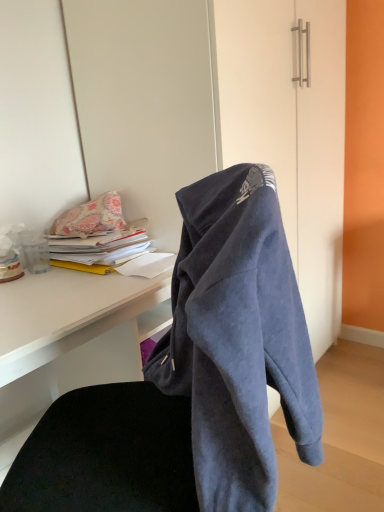
What do you see at coordinates (90, 218) in the screenshot? I see `floral fabric pillow at upper left` at bounding box center [90, 218].

What is the approximate height of matte white desk at center?

29.46 inches.

The width and height of the screenshot is (384, 512). What do you see at coordinates (103, 250) in the screenshot? I see `yellow paper at left` at bounding box center [103, 250].

Measure the distance between dark blue fleece hoodie at center and camera.

A distance of 20.55 inches exists between dark blue fleece hoodie at center and camera.

Locate an element on the screen. The width and height of the screenshot is (384, 512). floral fabric pillow at upper left is located at coordinates (90, 218).

Looking at this image, from a real-world perspective, between yellow paper at left and matte white desk at center, who is vertically lower?

In real-world perspective, matte white desk at center is lower.

Between point (116, 245) and point (35, 319), which one is positioned behind?

The point (116, 245) is behind.

Can you confirm if yellow paper at left is shorter than matte white desk at center?

Correct, yellow paper at left is not as tall as matte white desk at center.

Which object is closer to the camera taking this photo, dark blue fleece hoodie at center or yellow paper at left?

dark blue fleece hoodie at center is closer to the camera.

Between dark blue fleece hoodie at center and yellow paper at left, which one has larger width?

yellow paper at left is wider.

Is dark blue fleece hoodie at center touching yellow paper at left?

There is a gap between dark blue fleece hoodie at center and yellow paper at left.

Which is more to the left, dark blue fleece hoodie at center or yellow paper at left?

yellow paper at left.

Considering the positions of objects dark blue fleece hoodie at center and floral fabric pillow at upper left in the image provided, who is behind, dark blue fleece hoodie at center or floral fabric pillow at upper left?

floral fabric pillow at upper left is further from the camera.

Is floral fabric pillow at upper left located within dark blue fleece hoodie at center?

No.

Does dark blue fleece hoodie at center have a larger size compared to floral fabric pillow at upper left?

Yes.

Is dark blue fleece hoodie at center wider than floral fabric pillow at upper left?

Correct, the width of dark blue fleece hoodie at center exceeds that of floral fabric pillow at upper left.

Locate an element on the screen. The height and width of the screenshot is (512, 384). pillow above the yellow paper at left (from a real-world perspective) is located at coordinates (90, 218).

Is floral fabric pillow at upper left inside yellow paper at left?

No, yellow paper at left does not contain floral fabric pillow at upper left.

Is yellow paper at left looking in the opposite direction of floral fabric pillow at upper left?

yellow paper at left is not turned away from floral fabric pillow at upper left.

Considering the sizes of yellow paper at left and floral fabric pillow at upper left in the image, is yellow paper at left bigger or smaller than floral fabric pillow at upper left?

Clearly, yellow paper at left is larger in size than floral fabric pillow at upper left.

Is dark blue fleece hoodie at center inside yellow paper at left?

That's incorrect, dark blue fleece hoodie at center is not inside yellow paper at left.

From the picture: Is yellow paper at left in front of dark blue fleece hoodie at center?

No, yellow paper at left is further to the viewer.

From the image's perspective, is yellow paper at left located above or below dark blue fleece hoodie at center?

yellow paper at left is above dark blue fleece hoodie at center.

Between yellow paper at left and dark blue fleece hoodie at center, which one has smaller size?

yellow paper at left is smaller.

From the image's perspective, does dark blue fleece hoodie at center appear lower than matte white desk at center?

No, from the image's perspective, dark blue fleece hoodie at center is not below matte white desk at center.

Does dark blue fleece hoodie at center have a smaller size compared to matte white desk at center?

Indeed, dark blue fleece hoodie at center has a smaller size compared to matte white desk at center.

Is dark blue fleece hoodie at center positioned behind matte white desk at center?

No, dark blue fleece hoodie at center is in front of matte white desk at center.

How different are the orientations of dark blue fleece hoodie at center and matte white desk at center in degrees?

dark blue fleece hoodie at center and matte white desk at center are facing 136 degrees away from each other.

Which is nearer, (x=111, y=204) or (x=65, y=309)?

The point (x=65, y=309) is more forward.

The width and height of the screenshot is (384, 512). What are the coordinates of `desk to the right of floral fabric pillow at upper left` in the screenshot? It's located at (73, 341).

Based on the photo, does floral fabric pillow at upper left appear on the left side of matte white desk at center?

Yes.

From a real-world perspective, who is located higher, floral fabric pillow at upper left or matte white desk at center?

In real-world perspective, floral fabric pillow at upper left is above.

Locate an element on the screen. The height and width of the screenshot is (512, 384). book above the matte white desk at center (from the image's perspective) is located at coordinates (103, 250).

You are a GUI agent. You are given a task and a screenshot of the screen. Output one action in this format:
    pyautogui.click(x=<x>, y=<y>)
    Task: Click on the book behind the dark blue fleece hoodie at center
    The width and height of the screenshot is (384, 512).
    Given the screenshot: What is the action you would take?
    pyautogui.click(x=103, y=250)

Considering their positions, is dark blue fleece hoodie at center positioned closer to yellow paper at left than matte white desk at center?

The object closer to yellow paper at left is matte white desk at center.

Which object lies further to the anchor point floral fabric pillow at upper left, dark blue fleece hoodie at center or yellow paper at left?

dark blue fleece hoodie at center is further to floral fabric pillow at upper left.

From the image, which object appears to be farther from matte white desk at center, floral fabric pillow at upper left or yellow paper at left?

Result: Among the two, floral fabric pillow at upper left is located further to matte white desk at center.

Estimate the real-world distances between objects in this image. Which object is further from dark blue fleece hoodie at center, matte white desk at center or floral fabric pillow at upper left?

Among the two, floral fabric pillow at upper left is located further to dark blue fleece hoodie at center.

When comparing their distances from yellow paper at left, does floral fabric pillow at upper left or dark blue fleece hoodie at center seem closer?

floral fabric pillow at upper left.

From the image, which object appears to be nearer to matte white desk at center, floral fabric pillow at upper left or dark blue fleece hoodie at center?

floral fabric pillow at upper left.

Considering their positions, is dark blue fleece hoodie at center positioned closer to yellow paper at left than floral fabric pillow at upper left?

floral fabric pillow at upper left is positioned closer to the anchor yellow paper at left.

Considering their positions, is matte white desk at center positioned further to yellow paper at left than floral fabric pillow at upper left?

The object further to yellow paper at left is matte white desk at center.

Locate an element on the screen. The width and height of the screenshot is (384, 512). book between floral fabric pillow at upper left and matte white desk at center in the vertical direction is located at coordinates (103, 250).

Identify the location of book between dark blue fleece hoodie at center and floral fabric pillow at upper left along the z-axis. (103, 250).

You are a GUI agent. You are given a task and a screenshot of the screen. Output one action in this format:
    pyautogui.click(x=<x>, y=<y>)
    Task: Click on the desk between dark blue fleece hoodie at center and floral fabric pillow at upper left in the front-back direction
    This screenshot has height=512, width=384.
    Given the screenshot: What is the action you would take?
    pyautogui.click(x=73, y=341)

Locate an element on the screen. This screenshot has width=384, height=512. desk positioned between dark blue fleece hoodie at center and yellow paper at left from near to far is located at coordinates (73, 341).